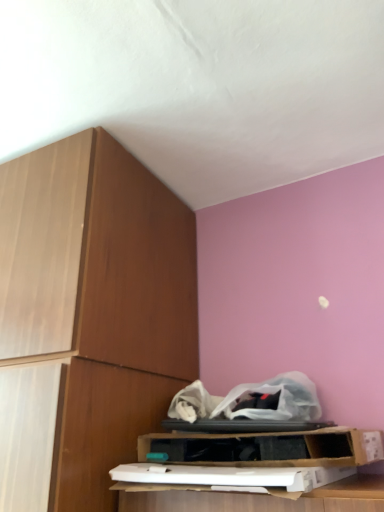
Question: From a real-world perspective, is wooden cabinet at left physically below cardboard box at lower center?

Choices:
 (A) yes
 (B) no

Answer: (B)

Question: Is wooden cabinet at left positioned beyond the bounds of cardboard box at lower center?

Choices:
 (A) no
 (B) yes

Answer: (B)

Question: From the image's perspective, is wooden cabinet at left beneath cardboard box at lower center?

Choices:
 (A) no
 (B) yes

Answer: (A)

Question: Is wooden cabinet at left thinner than cardboard box at lower center?

Choices:
 (A) no
 (B) yes

Answer: (A)

Question: Can you confirm if wooden cabinet at left is taller than cardboard box at lower center?

Choices:
 (A) yes
 (B) no

Answer: (A)

Question: Is wooden cabinet at left oriented away from cardboard box at lower center?

Choices:
 (A) no
 (B) yes

Answer: (A)

Question: Is cardboard box at lower center in front of wooden cabinet at left?

Choices:
 (A) no
 (B) yes

Answer: (A)

Question: From a real-world perspective, is cardboard box at lower center over wooden cabinet at left?

Choices:
 (A) yes
 (B) no

Answer: (B)

Question: Is cardboard box at lower center to the right of wooden cabinet at left from the viewer's perspective?

Choices:
 (A) no
 (B) yes

Answer: (B)

Question: Considering the relative positions of cardboard box at lower center and wooden cabinet at left in the image provided, is cardboard box at lower center behind wooden cabinet at left?

Choices:
 (A) no
 (B) yes

Answer: (B)

Question: Does cardboard box at lower center turn towards wooden cabinet at left?

Choices:
 (A) yes
 (B) no

Answer: (B)

Question: Is wooden cabinet at left at the back of cardboard box at lower center?

Choices:
 (A) yes
 (B) no

Answer: (B)

Question: From a real-world perspective, relative to cardboard box at lower center, is wooden cabinet at left vertically above or below?

Choices:
 (A) above
 (B) below

Answer: (A)